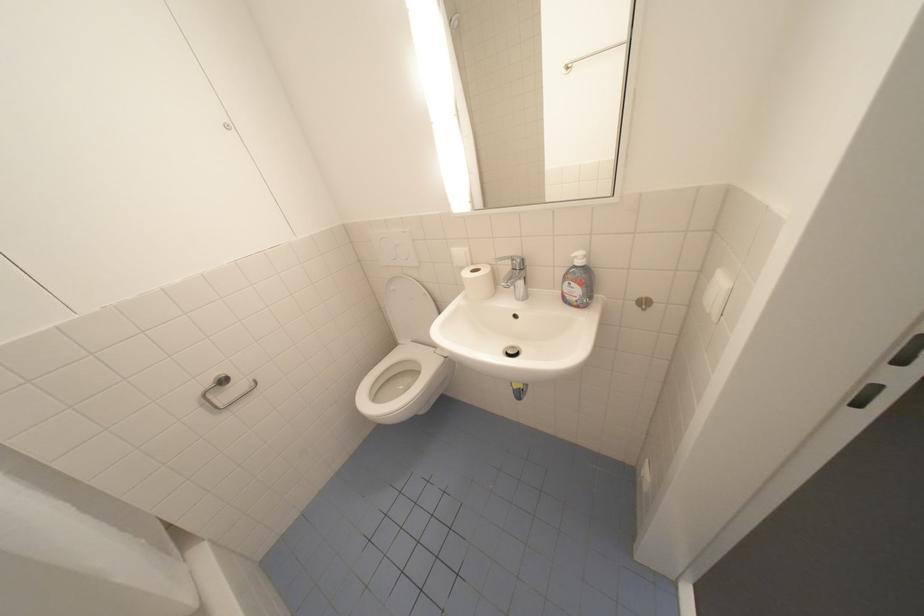
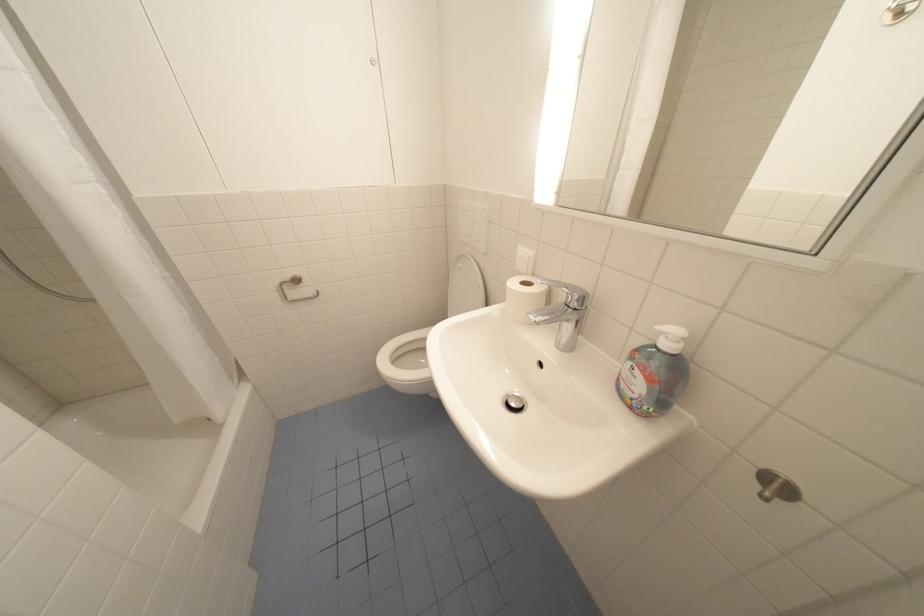
Where in the second image is the point corresponding to [518,268] from the first image?

(572, 301)